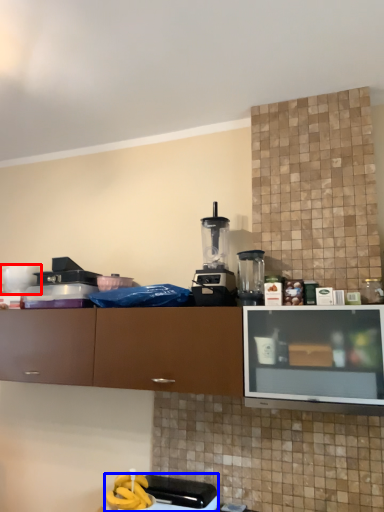
Question: Which of the following is the farthest to the observer, appliance (highlighted by a red box) or appliance (highlighted by a blue box)?

Choices:
 (A) appliance
 (B) appliance

Answer: (A)